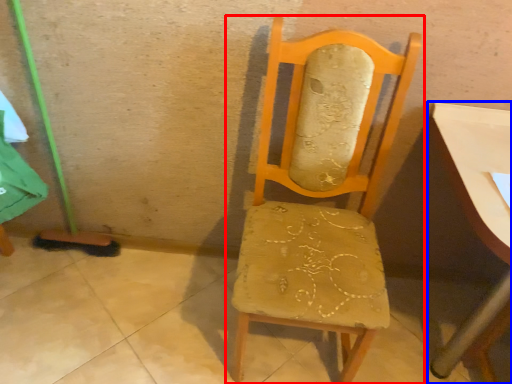
Question: Which point is closer to the camera, chair (highlighted by a red box) or table (highlighted by a blue box)?

Choices:
 (A) chair
 (B) table

Answer: (A)